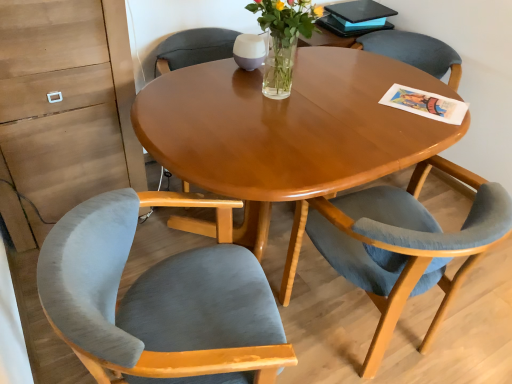
Question: Do you think velvet blue chair at lower right, positioned as the second chair in left-to-right order, is within velvet grey chair at left, the second chair when ordered from right to left, or outside of it?

Choices:
 (A) inside
 (B) outside

Answer: (B)

Question: Considering the positions of velvet blue chair at lower right, positioned as the second chair in left-to-right order, and velvet grey chair at left, which is counted as the first chair, starting from the left, in the image, is velvet blue chair at lower right, positioned as the second chair in left-to-right order, bigger or smaller than velvet grey chair at left, which is counted as the first chair, starting from the left,?

Choices:
 (A) big
 (B) small

Answer: (A)

Question: Which is farther from the velvet blue chair at lower right, positioned as the second chair in left-to-right order?

Choices:
 (A) velvet grey chair at left, which is counted as the first chair, starting from the left
 (B) clear glass vase at center

Answer: (B)

Question: Which of these objects is positioned closest to the clear glass vase at center?

Choices:
 (A) velvet grey chair at left, which is counted as the first chair, starting from the left
 (B) velvet blue chair at lower right, positioned as the second chair in left-to-right order

Answer: (B)